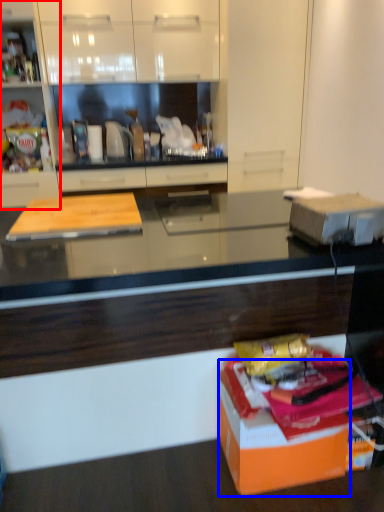
Question: Which object is further to the camera taking this photo, cabinetry (highlighted by a red box) or cardboard box (highlighted by a blue box)?

Choices:
 (A) cabinetry
 (B) cardboard box

Answer: (A)